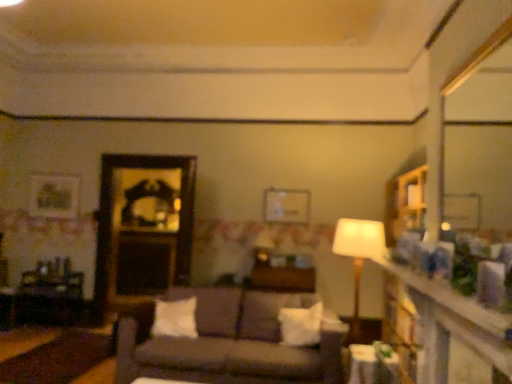
Question: Considering the relative sizes of wooden table at center, arranged as the 2th table when viewed from the right, and smooth wooden mirror at upper right, arranged as the 2th mirror when viewed from the back, in the image provided, is wooden table at center, arranged as the 2th table when viewed from the right, smaller than smooth wooden mirror at upper right, arranged as the 2th mirror when viewed from the back,?

Choices:
 (A) yes
 (B) no

Answer: (B)

Question: From a real-world perspective, is wooden table at center, which appears as the second table when viewed from the left, on smooth wooden mirror at upper right, positioned as the 1th mirror in right-to-left order?

Choices:
 (A) yes
 (B) no

Answer: (B)

Question: Does wooden table at center, arranged as the second table when viewed from the back, come behind smooth wooden mirror at upper right, arranged as the 2th mirror when viewed from the back?

Choices:
 (A) yes
 (B) no

Answer: (A)

Question: Could you tell me if wooden table at center, arranged as the second table when viewed from the back, is facing smooth wooden mirror at upper right, positioned as the 1th mirror in right-to-left order?

Choices:
 (A) yes
 (B) no

Answer: (B)

Question: Considering the relative sizes of wooden table at center, which appears as the second table when viewed from the left, and smooth wooden mirror at upper right, arranged as the 1th mirror when viewed from the front, in the image provided, is wooden table at center, which appears as the second table when viewed from the left, taller than smooth wooden mirror at upper right, arranged as the 1th mirror when viewed from the front,?

Choices:
 (A) yes
 (B) no

Answer: (B)

Question: From a real-world perspective, is white soft pillow at center, which ranks as the 2th pillow in right-to-left order, above or below white soft pillow at center, arranged as the 2th pillow when viewed from the left?

Choices:
 (A) above
 (B) below

Answer: (A)

Question: Is white soft pillow at center, which ranks as the 2th pillow in right-to-left order, spatially inside white soft pillow at center, arranged as the 2th pillow when viewed from the left, or outside of it?

Choices:
 (A) inside
 (B) outside

Answer: (B)

Question: From the image's perspective, relative to white soft pillow at center, which is counted as the first pillow, starting from the right, is white soft pillow at center, which ranks as the 2th pillow in right-to-left order, above or below?

Choices:
 (A) above
 (B) below

Answer: (A)

Question: Is white soft pillow at center, placed as the 1th pillow when sorted from left to right, taller or shorter than white soft pillow at center, arranged as the 2th pillow when viewed from the left?

Choices:
 (A) short
 (B) tall

Answer: (A)

Question: Considering the relative positions of wooden dresser at right and white glossy table at lower right, which appears as the third table when viewed from the back, in the image provided, is wooden dresser at right to the left or to the right of white glossy table at lower right, which appears as the third table when viewed from the back,?

Choices:
 (A) left
 (B) right

Answer: (A)

Question: From a real-world perspective, relative to white glossy table at lower right, which appears as the third table when viewed from the back, is wooden dresser at right vertically above or below?

Choices:
 (A) above
 (B) below

Answer: (A)

Question: In terms of width, does wooden dresser at right look wider or thinner when compared to white glossy table at lower right, which appears as the third table when viewed from the back?

Choices:
 (A) thin
 (B) wide

Answer: (A)

Question: Relative to white glossy table at lower right, acting as the third table starting from the left, is wooden dresser at right in front or behind?

Choices:
 (A) front
 (B) behind

Answer: (A)

Question: Looking at their shapes, would you say white soft pillow at center, which is counted as the first pillow, starting from the right, is wider or thinner than smooth wooden mirror at upper right, arranged as the 2th mirror when viewed from the back?

Choices:
 (A) thin
 (B) wide

Answer: (B)

Question: Considering the positions of white soft pillow at center, which is counted as the first pillow, starting from the right, and smooth wooden mirror at upper right, arranged as the 2th mirror when viewed from the back, in the image, is white soft pillow at center, which is counted as the first pillow, starting from the right, taller or shorter than smooth wooden mirror at upper right, arranged as the 2th mirror when viewed from the back,?

Choices:
 (A) short
 (B) tall

Answer: (A)